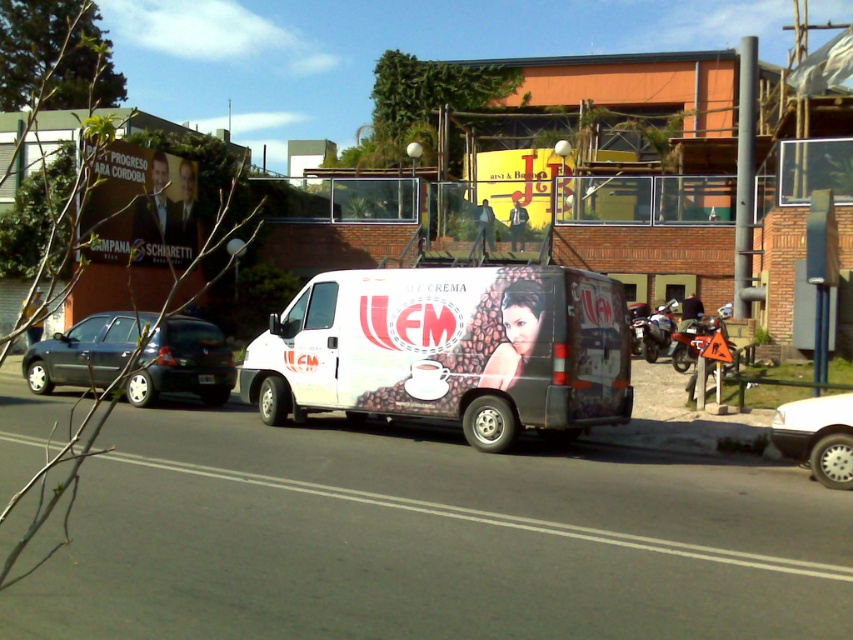
Question: Observing the image, what is the correct spatial positioning of matte dark blue hatchback at left in reference to matte plastic billboard at upper left?

Choices:
 (A) left
 (B) right

Answer: (A)

Question: Which of the following is the farthest from the observer?

Choices:
 (A) matte dark blue hatchback at left
 (B) metallic silver motorcycle at center-right
 (C) white matte van at center

Answer: (B)

Question: Which object is the closest to the white matte van at center?

Choices:
 (A) matte plastic billboard at upper left
 (B) metallic silver motorcycle at center
 (C) white matte car at lower right
 (D) metallic silver motorcycle at center-right

Answer: (C)

Question: Does white matte car at lower right have a smaller size compared to metallic silver motorcycle at center-right?

Choices:
 (A) no
 (B) yes

Answer: (B)

Question: Which object is closer to the camera taking this photo?

Choices:
 (A) metallic silver motorcycle at center-right
 (B) metallic silver motorcycle at center

Answer: (B)

Question: Can you confirm if matte dark blue hatchback at left is positioned above metallic silver motorcycle at center-right?

Choices:
 (A) yes
 (B) no

Answer: (B)